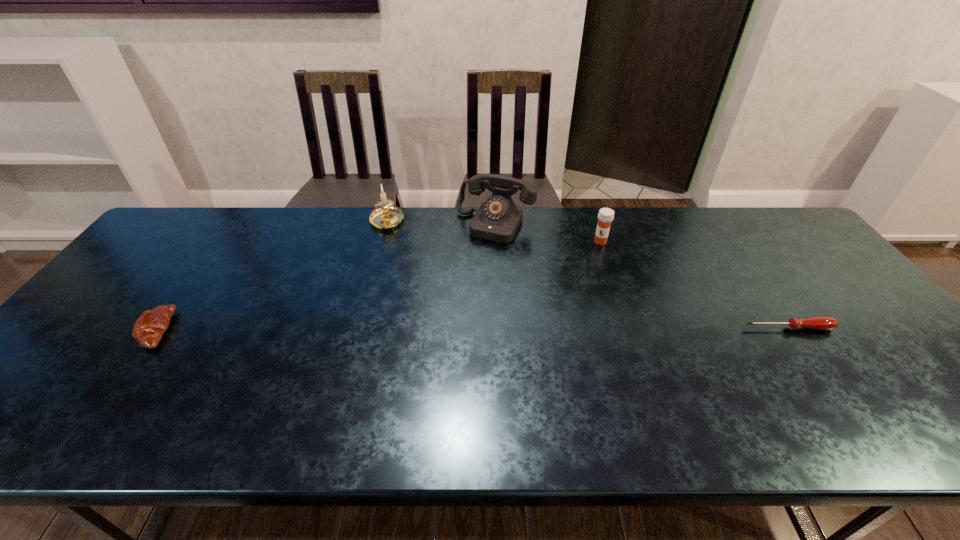
This screenshot has height=540, width=960. I want to click on vacant space situated 0.190m on the dial of the telephone, so click(x=460, y=282).

You are a GUI agent. You are given a task and a screenshot of the screen. Output one action in this format:
    pyautogui.click(x=<x>, y=<y>)
    Task: Click on the vacant area situated 0.160m on the dial of the telephone
    The width and height of the screenshot is (960, 540).
    Given the screenshot: What is the action you would take?
    pyautogui.click(x=464, y=275)

The height and width of the screenshot is (540, 960). In order to click on free space located on the dial of the telephone in this screenshot , I will do `click(463, 278)`.

I want to click on free space located on the handle side of the candle holder, so click(x=381, y=305).

Where is `blank area located on the handle side of the candle holder`? This screenshot has height=540, width=960. blank area located on the handle side of the candle holder is located at coordinates (380, 319).

Image resolution: width=960 pixels, height=540 pixels. I want to click on free spot located 0.200m on the handle side of the candle holder, so click(382, 278).

Image resolution: width=960 pixels, height=540 pixels. What are the coordinates of `vacant space located 0.380m on the label side of the fourth object from left to right` in the screenshot? It's located at (545, 323).

Image resolution: width=960 pixels, height=540 pixels. Find the location of `free space located 0.070m on the label side of the fourth object from left to right`. free space located 0.070m on the label side of the fourth object from left to right is located at coordinates (589, 258).

Where is `free region located on the label side of the fourth object from left to right`? The width and height of the screenshot is (960, 540). free region located on the label side of the fourth object from left to right is located at coordinates click(x=553, y=312).

Find the location of a particular element. This screenshot has width=960, height=540. telephone located in the far edge section of the desktop is located at coordinates (498, 218).